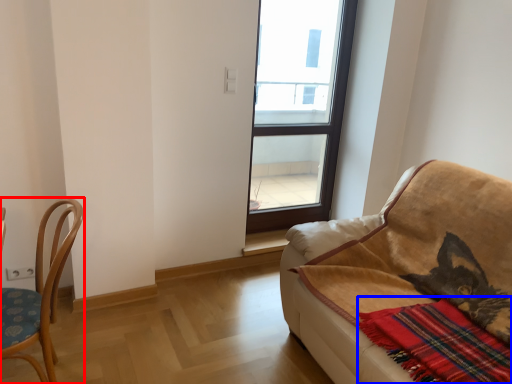
Question: Which object is further to the camera taking this photo, chair (highlighted by a red box) or plaid (highlighted by a blue box)?

Choices:
 (A) chair
 (B) plaid

Answer: (A)